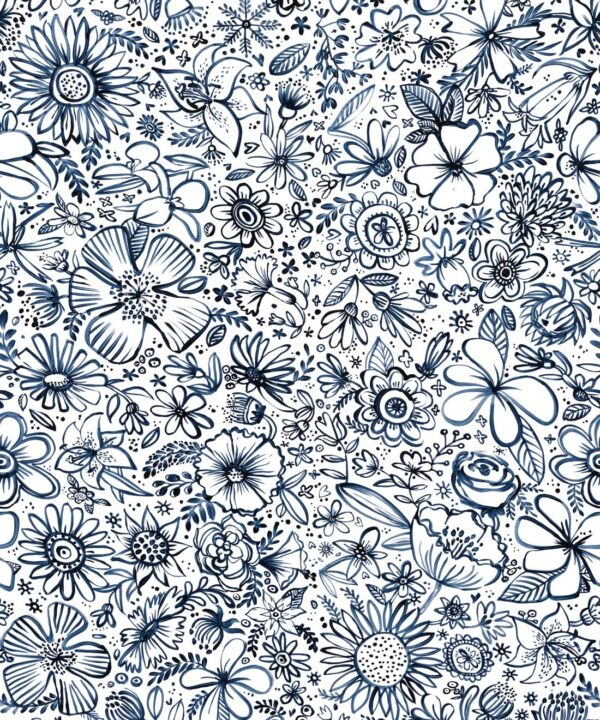
Locate an element on the screen. picture is located at coordinates (324, 363).